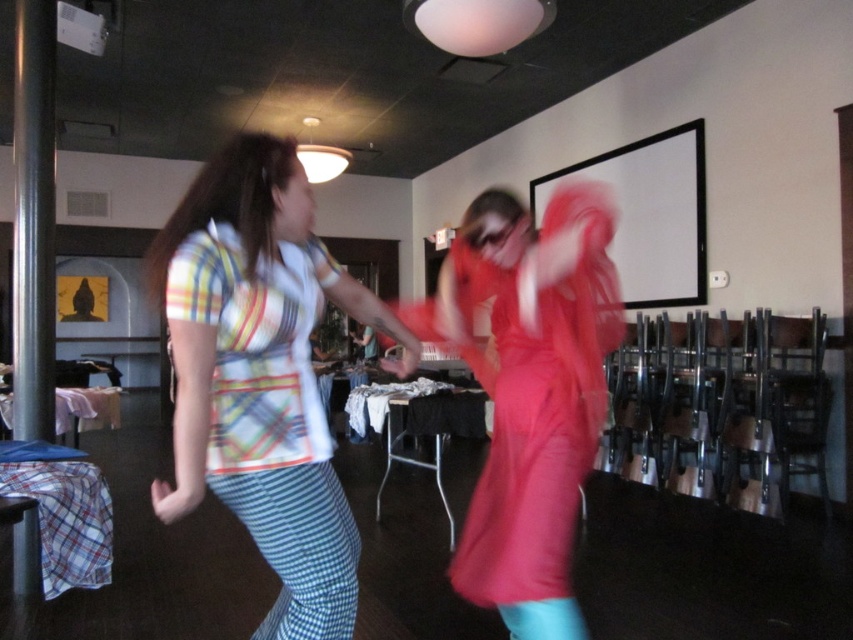
Consider the image. You are at a social event and want to take a photo of both the striped cotton shirt at center and the matte pink dress at center. Which one should you focus on first to ensure both are in focus?

You should focus on the striped cotton shirt at center first because it is closer to the viewer than the matte pink dress at center, allowing the depth of field to cover both subjects.

You are a photographer trying to capture a candid shot of both the striped cotton shirt at center and the matte pink dress at center in the same frame. Given that your camera has a focal length of 50mm and a sensor size of 24x36mm, what is the minimum distance you need to stand from the subjects to ensure both are fully in frame?

The minimum distance required is approximately 2.5 meters. This is calculated using the formula for depth of field and sensor coverage, ensuring both the striped cotton shirt at center and the matte pink dress at center are within the 50mm focal length range.